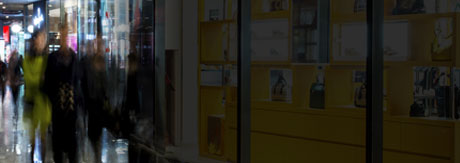
You are a GUI agent. You are given a task and a screenshot of the screen. Output one action in this format:
    pyautogui.click(x=<x>, y=<y>)
    Task: Click on the metal frames
    
    Given the screenshot: What is the action you would take?
    pyautogui.click(x=243, y=66), pyautogui.click(x=375, y=76)